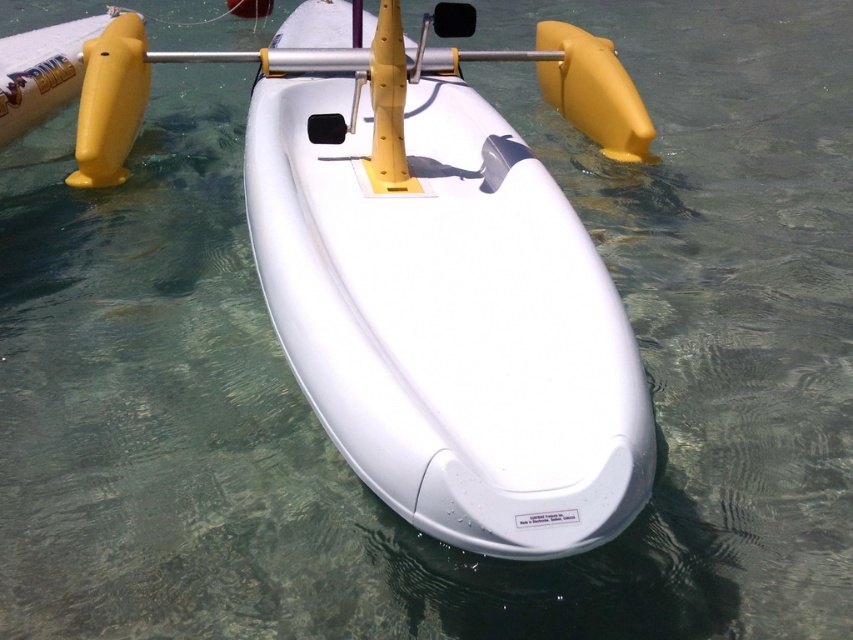
Question: Where is white matte kayak at center located in relation to yellow matte paddle at center in the image?

Choices:
 (A) above
 (B) below

Answer: (B)

Question: Which of the following is the closest to the observer?

Choices:
 (A) white matte kayak at center
 (B) yellow matte paddle at center

Answer: (A)

Question: Is white matte kayak at center above yellow matte paddle at center?

Choices:
 (A) yes
 (B) no

Answer: (B)

Question: Which object is closer to the camera taking this photo?

Choices:
 (A) yellow matte paddle at center
 (B) white matte kayak at center

Answer: (B)

Question: Does white matte kayak at center have a lesser width compared to yellow matte paddle at center?

Choices:
 (A) no
 (B) yes

Answer: (A)